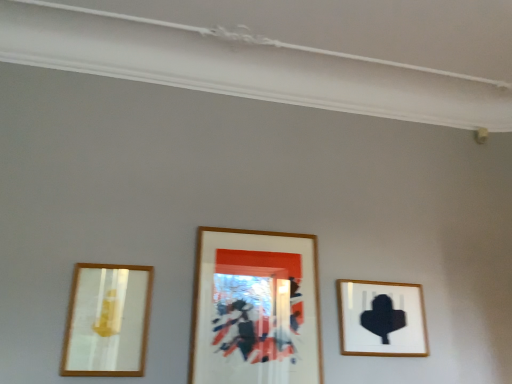
Question: From the image's perspective, would you say matte gold mirror at left, arranged as the third picture frame when viewed from the right, is shown under matte black silhouette at right, which is counted as the first picture frame, starting from the right?

Choices:
 (A) no
 (B) yes

Answer: (A)

Question: Considering the relative positions of matte gold mirror at left, arranged as the third picture frame when viewed from the right, and matte black silhouette at right, which is counted as the first picture frame, starting from the right, in the image provided, is matte gold mirror at left, arranged as the third picture frame when viewed from the right, to the left of matte black silhouette at right, which is counted as the first picture frame, starting from the right, from the viewer's perspective?

Choices:
 (A) yes
 (B) no

Answer: (A)

Question: Is matte gold mirror at left, arranged as the first picture frame when viewed from the left, looking in the opposite direction of matte black silhouette at right, which is counted as the first picture frame, starting from the right?

Choices:
 (A) no
 (B) yes

Answer: (A)

Question: Does matte gold mirror at left, arranged as the first picture frame when viewed from the left, have a smaller size compared to matte black silhouette at right, the 3th picture frame when ordered from left to right?

Choices:
 (A) no
 (B) yes

Answer: (B)

Question: From the image's perspective, is matte gold mirror at left, arranged as the first picture frame when viewed from the left, over matte black silhouette at right, the 3th picture frame when ordered from left to right?

Choices:
 (A) yes
 (B) no

Answer: (A)

Question: Is point (195, 273) positioned closer to the camera than point (110, 316)?

Choices:
 (A) farther
 (B) closer

Answer: (A)

Question: Is wooden framed artwork at center, the second picture frame positioned from the right, bigger or smaller than matte gold mirror at left, arranged as the third picture frame when viewed from the right?

Choices:
 (A) big
 (B) small

Answer: (A)

Question: From a real-world perspective, is wooden framed artwork at center, the second picture frame positioned from the right, above or below matte gold mirror at left, arranged as the third picture frame when viewed from the right?

Choices:
 (A) below
 (B) above

Answer: (B)

Question: Relative to matte gold mirror at left, arranged as the first picture frame when viewed from the left, is wooden framed artwork at center, the second picture frame when ordered from left to right, in front or behind?

Choices:
 (A) behind
 (B) front

Answer: (A)

Question: Looking at their shapes, would you say matte black silhouette at right, which is counted as the first picture frame, starting from the right, is wider or thinner than wooden framed artwork at center, the second picture frame positioned from the right?

Choices:
 (A) wide
 (B) thin

Answer: (A)

Question: From the image's perspective, is matte black silhouette at right, the 3th picture frame when ordered from left to right, located above or below wooden framed artwork at center, the second picture frame when ordered from left to right?

Choices:
 (A) above
 (B) below

Answer: (B)

Question: Considering the positions of point (337, 288) and point (287, 329), is point (337, 288) closer or farther from the camera than point (287, 329)?

Choices:
 (A) closer
 (B) farther

Answer: (B)

Question: Considering the positions of matte black silhouette at right, the 3th picture frame when ordered from left to right, and wooden framed artwork at center, the second picture frame when ordered from left to right, in the image, is matte black silhouette at right, the 3th picture frame when ordered from left to right, taller or shorter than wooden framed artwork at center, the second picture frame when ordered from left to right,?

Choices:
 (A) short
 (B) tall

Answer: (A)

Question: Is matte gold mirror at left, arranged as the first picture frame when viewed from the left, taller or shorter than matte black silhouette at right, the 3th picture frame when ordered from left to right?

Choices:
 (A) tall
 (B) short

Answer: (A)

Question: Would you say matte gold mirror at left, arranged as the first picture frame when viewed from the left, is to the left or to the right of matte black silhouette at right, which is counted as the first picture frame, starting from the right, in the picture?

Choices:
 (A) left
 (B) right

Answer: (A)